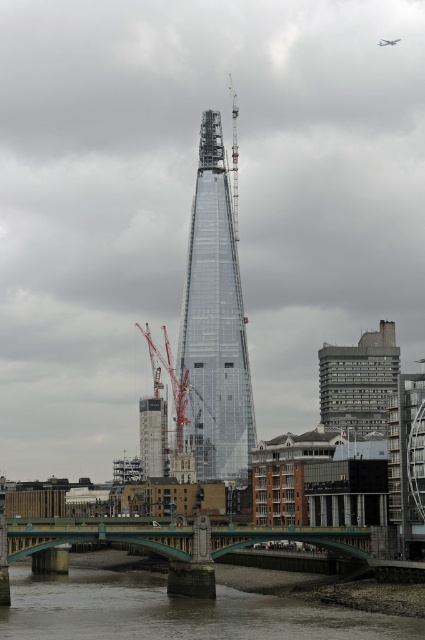
You are standing on the bridge looking at the construction site of The Shard. There are two points marked on the scene. Which point, point [300,536] or point [163,404], is closer to you?

Point [300,536] is closer to the viewer than point [163,404].

You are a city planner assessing the skyline. You need to determine which of the two central buildings, the transparent glass tower at center or the gray concrete building at center, will dominate the skyline when viewed from the river. Based on their heights, which one will appear taller?

The transparent glass tower at center is taller than the gray concrete building at center, so it will dominate the skyline and appear taller when viewed from the river.